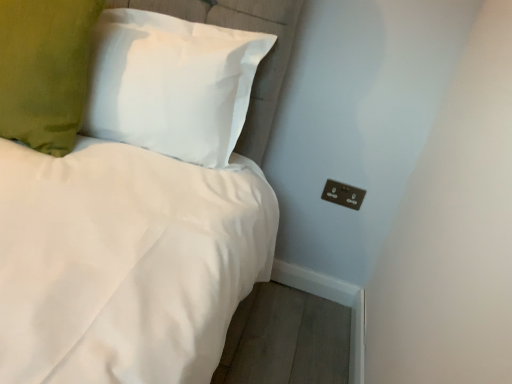
Question: Considering the positions of point (335, 187) and point (195, 107), is point (335, 187) closer or farther from the camera than point (195, 107)?

Choices:
 (A) closer
 (B) farther

Answer: (B)

Question: Considering the positions of black plastic outlet at lower right and white fabric pillow at upper left, the 1th pillow from the right, in the image, is black plastic outlet at lower right bigger or smaller than white fabric pillow at upper left, the 1th pillow from the right,?

Choices:
 (A) big
 (B) small

Answer: (B)

Question: Which is farther from the black plastic outlet at lower right?

Choices:
 (A) green velvet pillow at upper left, the second pillow from the right
 (B) white fabric pillow at upper left, the 1th pillow from the right

Answer: (A)

Question: Which object is the closest to the black plastic outlet at lower right?

Choices:
 (A) white fabric pillow at upper left, which is counted as the second pillow, starting from the left
 (B) green velvet pillow at upper left, the second pillow from the right

Answer: (A)